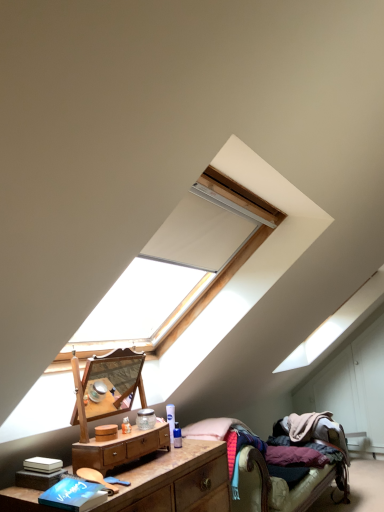
Question: From the image's perspective, is textured fabric bed at lower right under blue matte book at lower left?

Choices:
 (A) yes
 (B) no

Answer: (A)

Question: Is textured fabric bed at lower right oriented towards blue matte book at lower left?

Choices:
 (A) yes
 (B) no

Answer: (B)

Question: Is textured fabric bed at lower right not close to blue matte book at lower left?

Choices:
 (A) no
 (B) yes

Answer: (B)

Question: From a real-world perspective, is textured fabric bed at lower right on blue matte book at lower left?

Choices:
 (A) yes
 (B) no

Answer: (B)

Question: Can you confirm if textured fabric bed at lower right is bigger than blue matte book at lower left?

Choices:
 (A) no
 (B) yes

Answer: (B)

Question: Considering the relative sizes of textured fabric bed at lower right and blue matte book at lower left in the image provided, is textured fabric bed at lower right shorter than blue matte book at lower left?

Choices:
 (A) yes
 (B) no

Answer: (B)

Question: Is wooden polished nightstand at center, the 2th nightstand ordered from the bottom, positioned beyond the bounds of blue matte book at lower left?

Choices:
 (A) no
 (B) yes

Answer: (B)

Question: Does wooden polished nightstand at center, the 2th nightstand ordered from the bottom, come in front of blue matte book at lower left?

Choices:
 (A) yes
 (B) no

Answer: (B)

Question: From a real-world perspective, is wooden polished nightstand at center, the 2th nightstand ordered from the bottom, physically above blue matte book at lower left?

Choices:
 (A) no
 (B) yes

Answer: (B)

Question: Is blue matte book at lower left located within wooden polished nightstand at center, the 2th nightstand ordered from the bottom?

Choices:
 (A) yes
 (B) no

Answer: (B)

Question: Considering the relative positions of wooden polished nightstand at center, the first nightstand in the top-to-bottom sequence, and blue matte book at lower left in the image provided, is wooden polished nightstand at center, the first nightstand in the top-to-bottom sequence, to the right of blue matte book at lower left from the viewer's perspective?

Choices:
 (A) no
 (B) yes

Answer: (B)

Question: Does wooden polished nightstand at center, the 2th nightstand ordered from the bottom, have a smaller size compared to blue matte book at lower left?

Choices:
 (A) yes
 (B) no

Answer: (B)

Question: From the image's perspective, does wooden nightstand at lower left, placed as the first nightstand when sorted from bottom to top, appear higher than textured fabric bed at lower right?

Choices:
 (A) yes
 (B) no

Answer: (A)